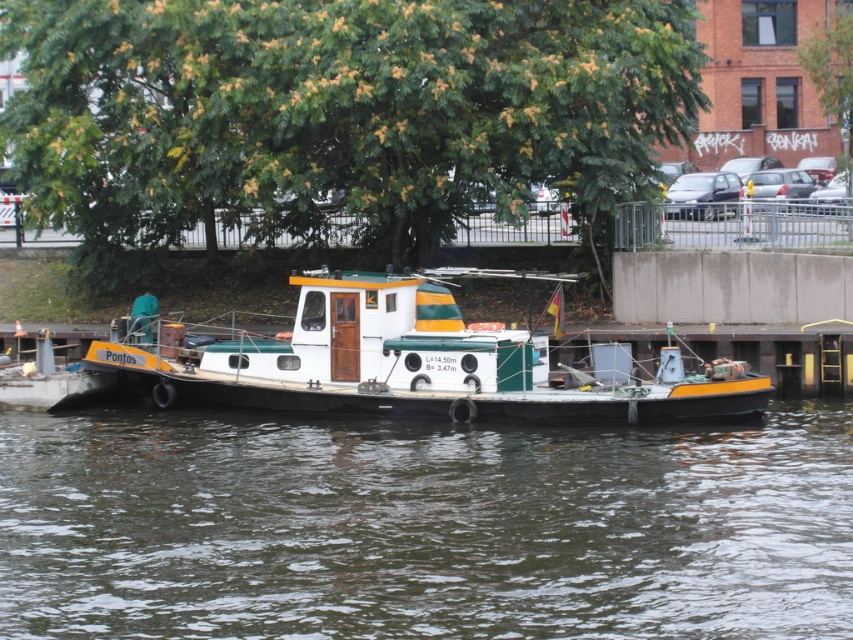
You are standing on the deck of the barge named Pontos and looking towards the dock. There is a green leafy tree at upper center located at point (339, 109). Which direction should you walk to get closer to the green leafy tree at upper center?

Since the green leafy tree at upper center is located at point (339, 109), you should walk towards the upper center direction to get closer to it.

You are a photographer planning to take a photo of the transparent water at center and the green leafy tree at upper center. Which object will occupy a larger area in your photo?

The green leafy tree at upper center will occupy a larger area in the photo since it is larger in size compared to the transparent water at center.

You are standing at the point marked as point (422, 528) on the barge Pontos. What is directly beneath your feet?

Transparent water at center is located at point (422, 528), so the transparent water at center is directly beneath your feet.